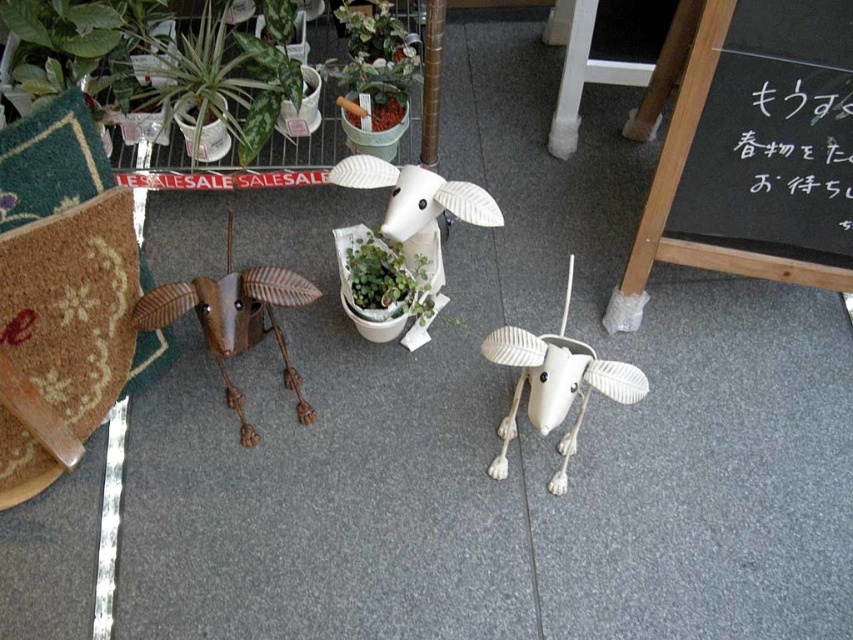
Is white matte sheep at center further to camera compared to green matte pot at center?

No, white matte sheep at center is closer to the viewer.

Who is positioned more to the right, white matte sheep at center or green matte pot at center?

white matte sheep at center is more to the right.

Is point (412, 170) in front of point (390, 278)?

Yes, point (412, 170) is closer to viewer.

Where is `white matte sheep at center`? This screenshot has height=640, width=853. white matte sheep at center is located at coordinates (418, 209).

Is metallic brown goat at left shorter than white matte plastic goat at center?

Yes, metallic brown goat at left is shorter than white matte plastic goat at center.

This screenshot has height=640, width=853. What do you see at coordinates (234, 320) in the screenshot?
I see `metallic brown goat at left` at bounding box center [234, 320].

Which is behind, point (260, 308) or point (575, 356)?

The point (260, 308) is behind.

Where is `metallic brown goat at left`? metallic brown goat at left is located at coordinates (234, 320).

Can you confirm if metallic brown goat at left is positioned to the left of green matte pot at center?

Correct, you'll find metallic brown goat at left to the left of green matte pot at center.

Does metallic brown goat at left have a greater width compared to green matte pot at center?

Correct, the width of metallic brown goat at left exceeds that of green matte pot at center.

The image size is (853, 640). Identify the location of metallic brown goat at left. (234, 320).